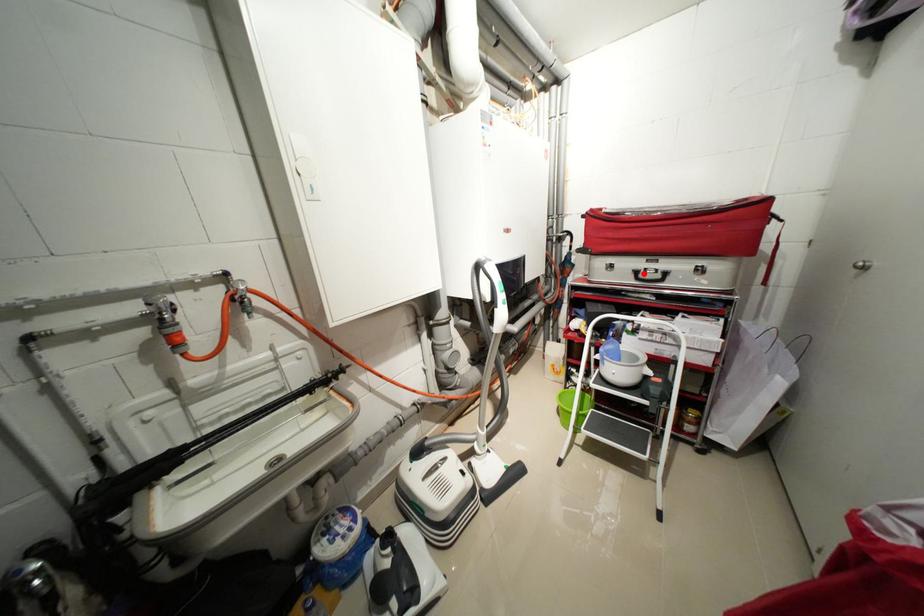
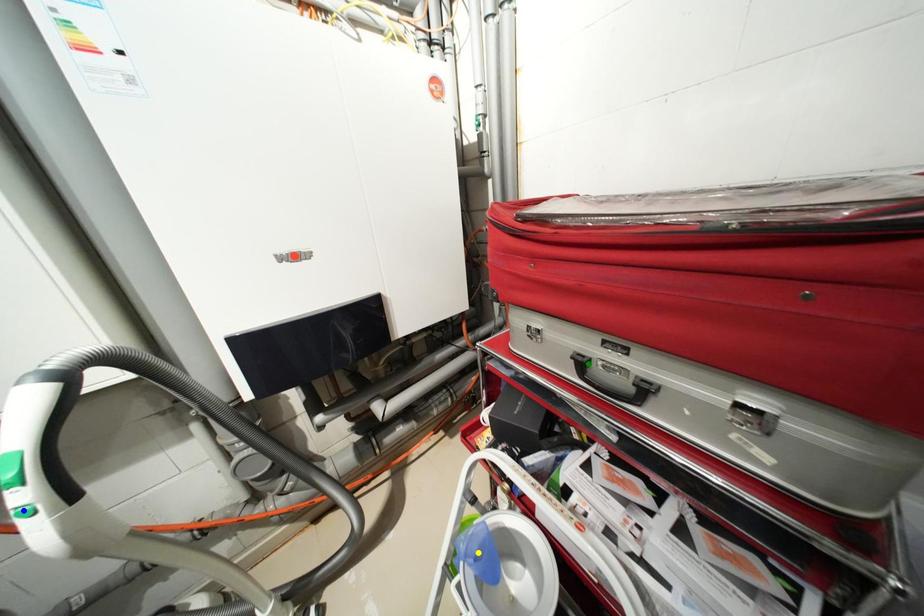
Question: I am providing you with two images of the same scene from different viewpoints. A red point is marked on the first image. You are given multiple points on the second image. Can you choose the point in image 2 that corresponds to the point in image 1?

Choices:
 (A) green point
 (B) blue point
 (C) yellow point

Answer: (A)